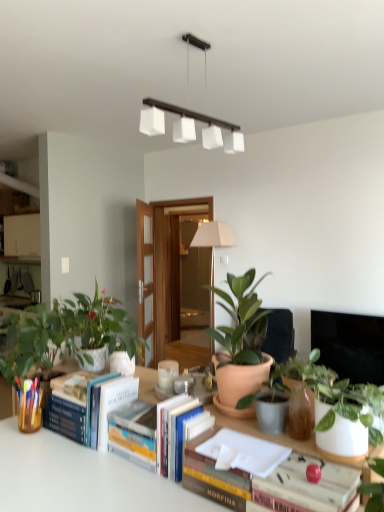
The width and height of the screenshot is (384, 512). What are the coordinates of `vacant point above white matte rectangular light fixture at upper center (from a real-world perspective)` in the screenshot? It's located at (191, 37).